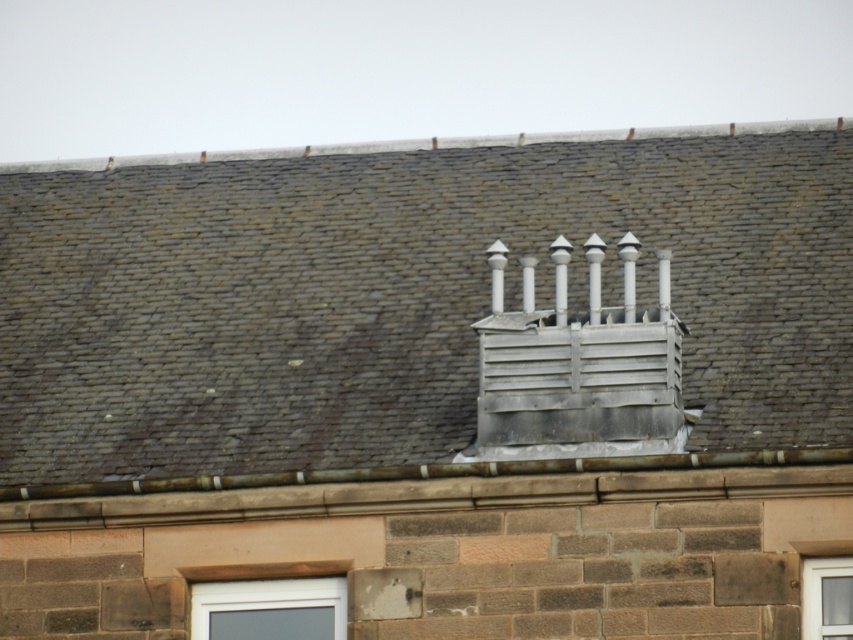
Question: Is metallic gray vent at center further to the viewer compared to clear glass window at center?

Choices:
 (A) yes
 (B) no

Answer: (B)

Question: Which point appears closest to the camera in this image?

Choices:
 (A) (821, 604)
 (B) (138, 474)
 (C) (303, 602)

Answer: (A)

Question: Which of these objects is positioned closest to the metallic gray vent at center?

Choices:
 (A) clear glass window at center
 (B) white plastic window at lower center

Answer: (B)

Question: Which object is positioned farthest from the clear glass window at center?

Choices:
 (A) white plastic window at lower center
 (B) metallic gray vent at center

Answer: (B)

Question: Is metallic gray vent at center bigger than clear glass window at center?

Choices:
 (A) no
 (B) yes

Answer: (B)

Question: Is metallic gray vent at center smaller than white plastic window at lower center?

Choices:
 (A) no
 (B) yes

Answer: (A)